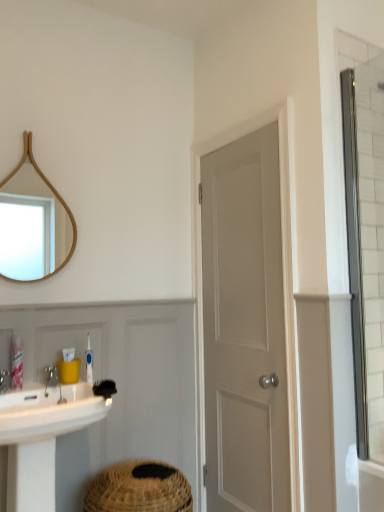
Question: Is blue plastic toothbrush at lower left, acting as the third toiletry starting from the left, located within clear glass shower door at right?

Choices:
 (A) yes
 (B) no

Answer: (B)

Question: Is clear glass shower door at right placed right next to blue plastic toothbrush at lower left, acting as the first toiletry starting from the right?

Choices:
 (A) yes
 (B) no

Answer: (B)

Question: Does clear glass shower door at right appear on the left side of blue plastic toothbrush at lower left, acting as the first toiletry starting from the right?

Choices:
 (A) yes
 (B) no

Answer: (B)

Question: Does clear glass shower door at right have a lesser width compared to blue plastic toothbrush at lower left, acting as the first toiletry starting from the right?

Choices:
 (A) yes
 (B) no

Answer: (B)

Question: Considering the relative sizes of clear glass shower door at right and blue plastic toothbrush at lower left, acting as the first toiletry starting from the right, in the image provided, is clear glass shower door at right wider than blue plastic toothbrush at lower left, acting as the first toiletry starting from the right,?

Choices:
 (A) yes
 (B) no

Answer: (A)

Question: From a real-world perspective, is black bristle brush at lower center above or below wooden mirror at upper left?

Choices:
 (A) above
 (B) below

Answer: (B)

Question: Considering the positions of black bristle brush at lower center and wooden mirror at upper left in the image, is black bristle brush at lower center wider or thinner than wooden mirror at upper left?

Choices:
 (A) thin
 (B) wide

Answer: (B)

Question: Considering the relative positions of black bristle brush at lower center and wooden mirror at upper left in the image provided, is black bristle brush at lower center to the left or to the right of wooden mirror at upper left?

Choices:
 (A) left
 (B) right

Answer: (B)

Question: Is point (110, 394) positioned closer to the camera than point (23, 190)?

Choices:
 (A) farther
 (B) closer

Answer: (B)

Question: Is point (72, 351) positioned closer to the camera than point (362, 352)?

Choices:
 (A) closer
 (B) farther

Answer: (B)

Question: Relative to clear glass shower door at right, is yellow plastic container at sink, the 2th toiletry from the left, in front or behind?

Choices:
 (A) front
 (B) behind

Answer: (B)

Question: Based on their positions, is yellow plastic container at sink, the 2th toiletry from the left, located to the left or right of clear glass shower door at right?

Choices:
 (A) right
 (B) left

Answer: (B)

Question: From a real-world perspective, relative to clear glass shower door at right, is yellow plastic container at sink, the 2th toiletry from the left, vertically above or below?

Choices:
 (A) below
 (B) above

Answer: (A)

Question: Is wooden mirror at upper left spatially inside black bristle brush at lower center, or outside of it?

Choices:
 (A) inside
 (B) outside

Answer: (B)

Question: Does point (54, 197) appear closer or farther from the camera than point (115, 389)?

Choices:
 (A) farther
 (B) closer

Answer: (B)